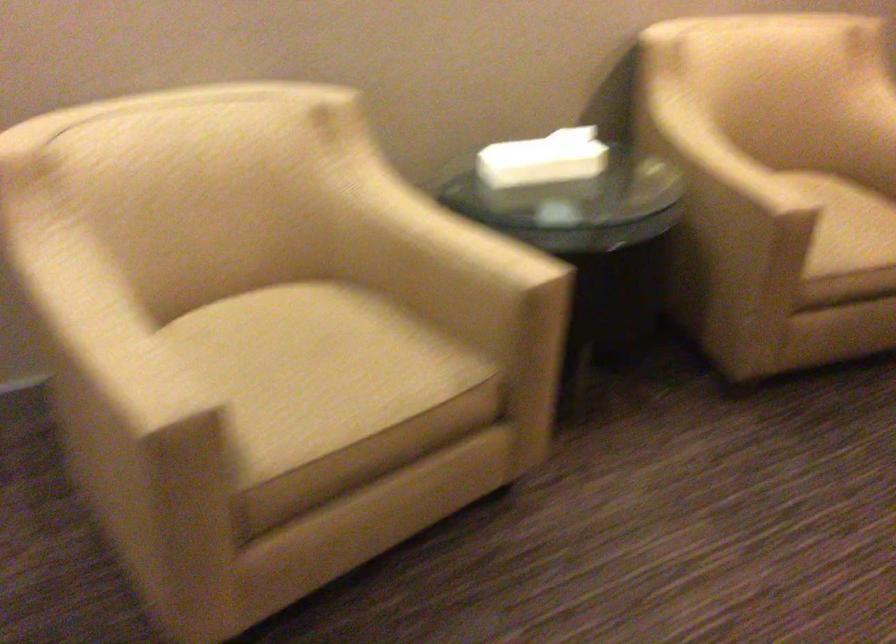
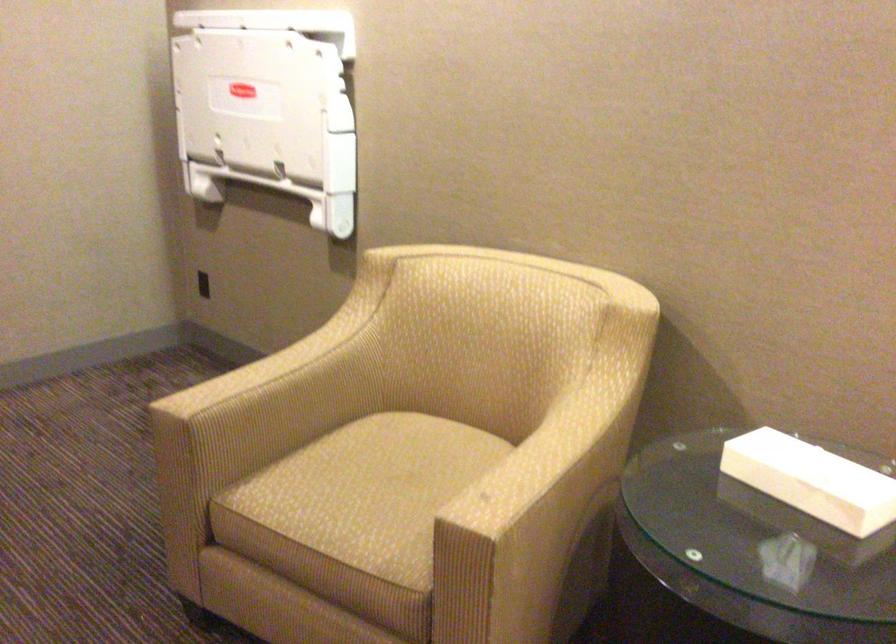
Locate, in the second image, the point that corresponds to (332,366) in the first image.

(371, 491)